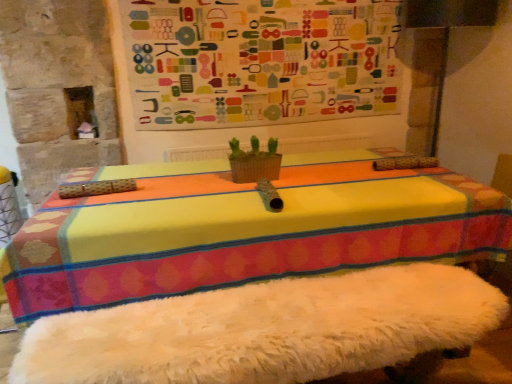
Question: From a real-world perspective, is multicolored fabric bulletin board at upper center physically located above or below woven basket at center?

Choices:
 (A) below
 (B) above

Answer: (B)

Question: Relative to woven basket at center, is multicolored fabric bulletin board at upper center in front or behind?

Choices:
 (A) behind
 (B) front

Answer: (A)

Question: Looking at the image, does multicolored fabric bulletin board at upper center seem bigger or smaller compared to woven basket at center?

Choices:
 (A) big
 (B) small

Answer: (A)

Question: Is woven basket at center taller or shorter than multicolored fabric bulletin board at upper center?

Choices:
 (A) short
 (B) tall

Answer: (A)

Question: In terms of size, does woven basket at center appear bigger or smaller than multicolored fabric bulletin board at upper center?

Choices:
 (A) small
 (B) big

Answer: (A)

Question: Is woven basket at center wider or thinner than multicolored fabric bulletin board at upper center?

Choices:
 (A) wide
 (B) thin

Answer: (A)

Question: Is woven basket at center in front of or behind multicolored fabric bulletin board at upper center in the image?

Choices:
 (A) behind
 (B) front

Answer: (B)